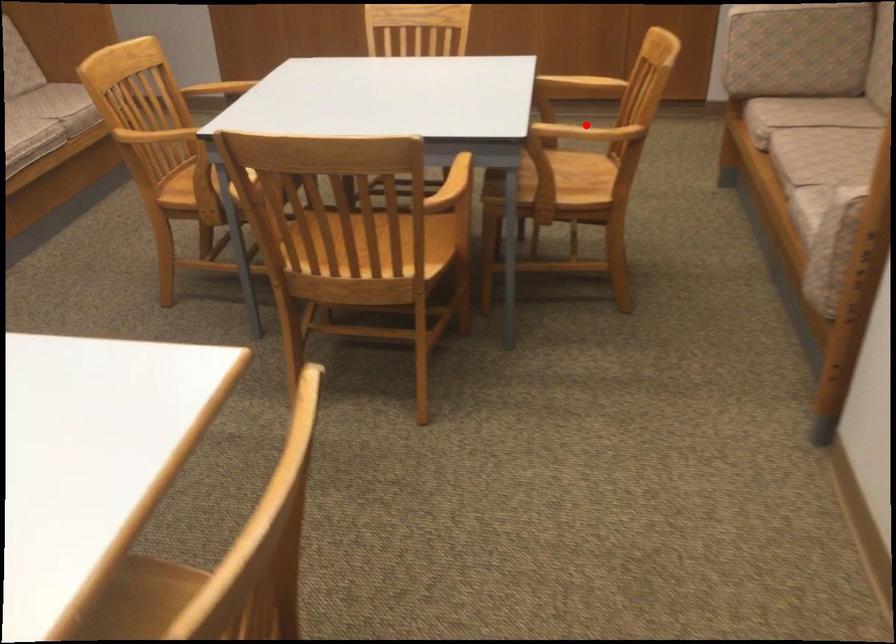
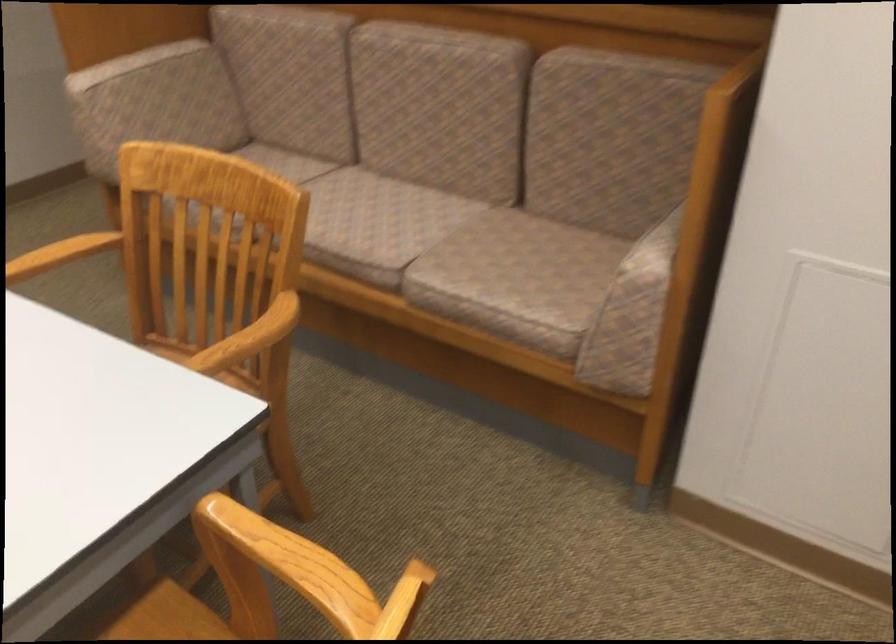
Where in the second image is the point corresponding to the highlighted location from the first image?

(248, 339)